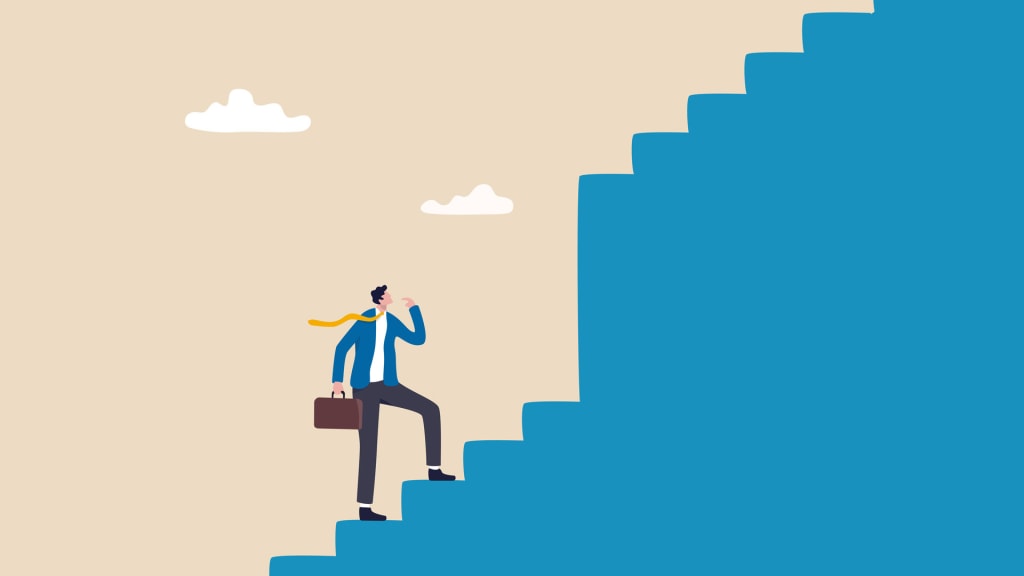
You are a GUI agent. You are given a task and a screenshot of the screen. Output one action in this format:
    pyautogui.click(x=<x>, y=<y>)
    Task: Click on the steps in staircase
    Image resolution: width=1024 pixels, height=576 pixels.
    Given the screenshot: What is the action you would take?
    pyautogui.click(x=299, y=555), pyautogui.click(x=373, y=522), pyautogui.click(x=431, y=481), pyautogui.click(x=487, y=439), pyautogui.click(x=554, y=401), pyautogui.click(x=601, y=174), pyautogui.click(x=654, y=128), pyautogui.click(x=716, y=94), pyautogui.click(x=772, y=55), pyautogui.click(x=835, y=13)